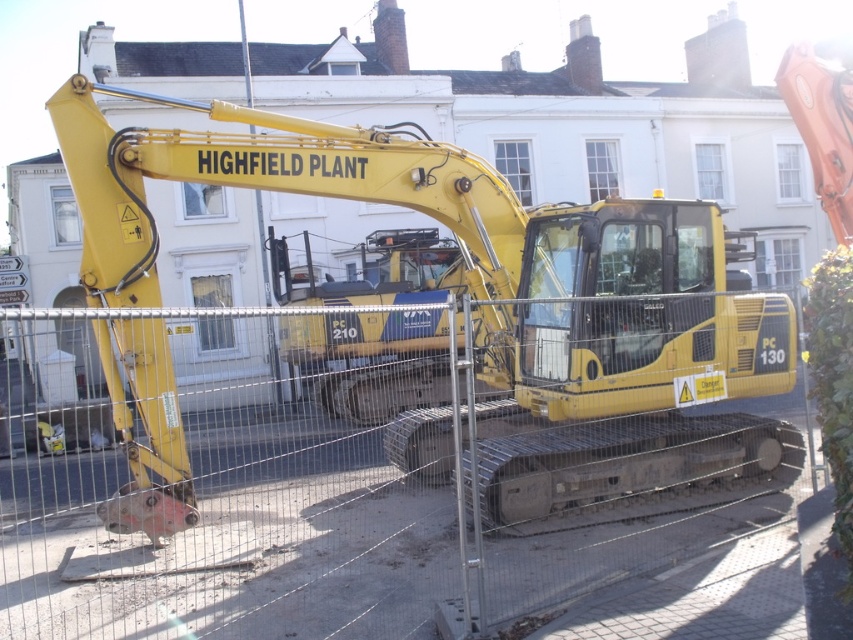
Question: Which point is closer to the camera taking this photo?

Choices:
 (A) (142, 291)
 (B) (485, 520)

Answer: (A)

Question: Does metal mesh fence at center come behind yellow rubber excavator at center?

Choices:
 (A) yes
 (B) no

Answer: (B)

Question: Can you confirm if metal mesh fence at center is smaller than yellow rubber excavator at center?

Choices:
 (A) yes
 (B) no

Answer: (A)

Question: Which object appears farthest from the camera in this image?

Choices:
 (A) metal mesh fence at center
 (B) yellow rubber excavator at center

Answer: (B)

Question: Is metal mesh fence at center smaller than yellow rubber excavator at center?

Choices:
 (A) no
 (B) yes

Answer: (B)